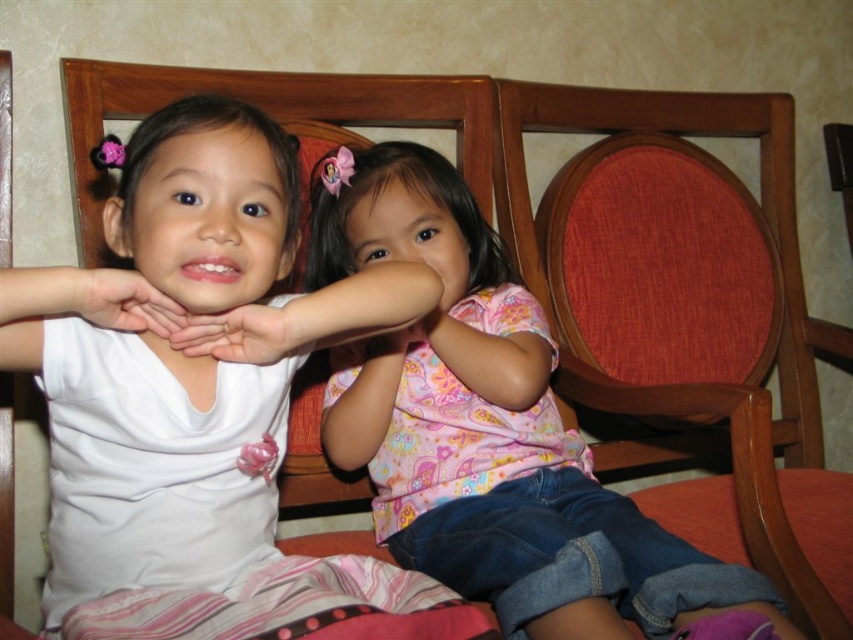
Who is taller, white matte arm at center or matte white hands at center?

white matte arm at center

Does white matte arm at center come behind matte white hands at center?

No, it is in front of matte white hands at center.

Is point (165, 321) less distant than point (273, 358)?

Yes, it is in front of point (273, 358).

You are a GUI agent. You are given a task and a screenshot of the screen. Output one action in this format:
    pyautogui.click(x=<x>, y=<y>)
    Task: Click on the white matte arm at center
    The height and width of the screenshot is (640, 853).
    Given the screenshot: What is the action you would take?
    pyautogui.click(x=74, y=307)

Is matte white arm at center shorter than white matte arm at center?

Incorrect, matte white arm at center's height does not fall short of white matte arm at center's.

Does matte white arm at center have a greater height compared to white matte arm at center?

Yes.

Who is more forward, (312, 292) or (27, 301)?

Positioned in front is point (27, 301).

Locate an element on the screen. The height and width of the screenshot is (640, 853). matte white arm at center is located at coordinates (315, 316).

The width and height of the screenshot is (853, 640). What do you see at coordinates (488, 428) in the screenshot?
I see `pink floral shirt at center` at bounding box center [488, 428].

Does point (479, 492) come farther from viewer compared to point (167, 317)?

Yes, point (479, 492) is behind point (167, 317).

What do you see at coordinates (488, 428) in the screenshot? I see `pink floral shirt at center` at bounding box center [488, 428].

Find the location of `pink floral shirt at center`. pink floral shirt at center is located at coordinates (488, 428).